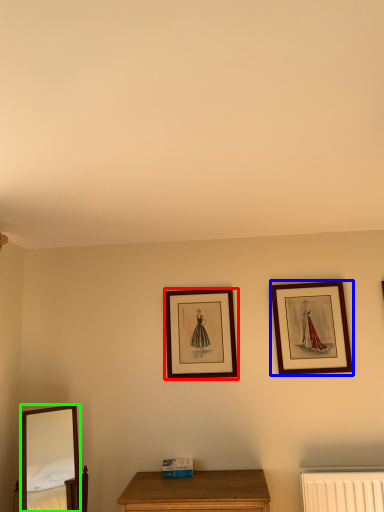
Question: Which is nearer to the picture frame (highlighted by a red box)? picture frame (highlighted by a blue box) or mirror (highlighted by a green box).

Choices:
 (A) picture frame
 (B) mirror

Answer: (A)